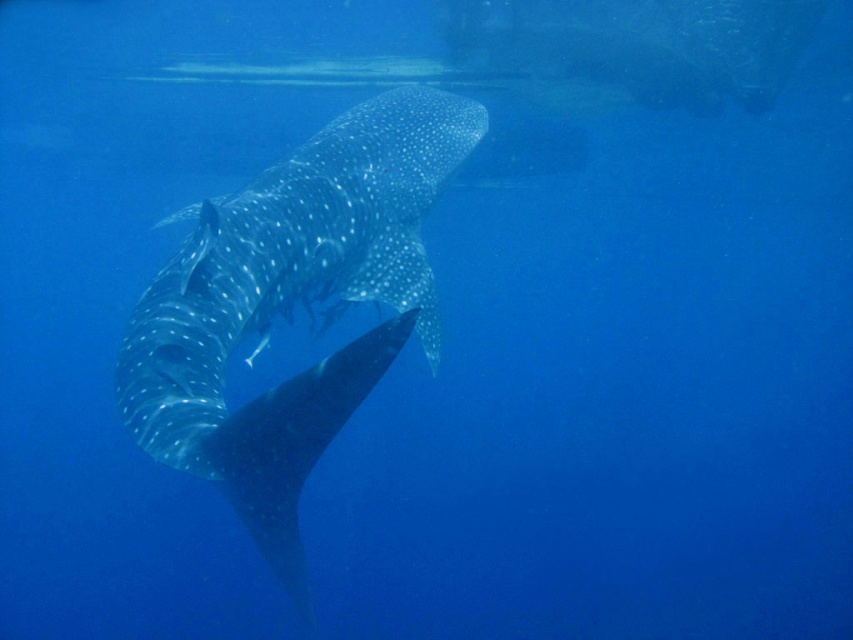
You are a marine biologist observing the underwater scene and need to identify which animal is taller between the speckled skin whale at center and the speckled skin stingray at center. Based on the image, which one is taller?

The speckled skin whale at center is taller than the speckled skin stingray at center.

You are a marine biologist observing the underwater scene. You notice two creatures with speckled skin at the center. Which one is closer to you, the speckled skin whale at center or the speckled skin stingray at center?

The speckled skin whale at center is closer to you because the speckled skin stingray at center is behind it.